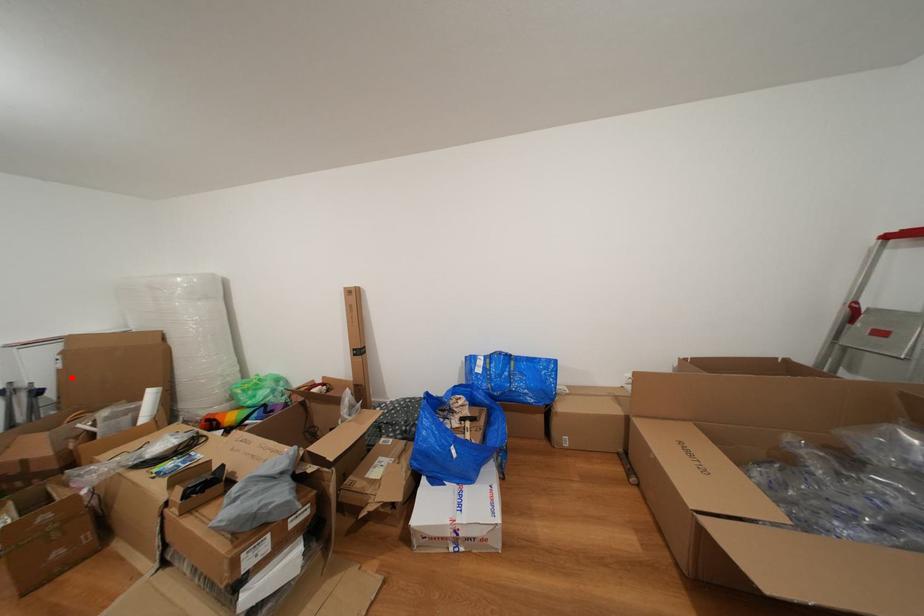
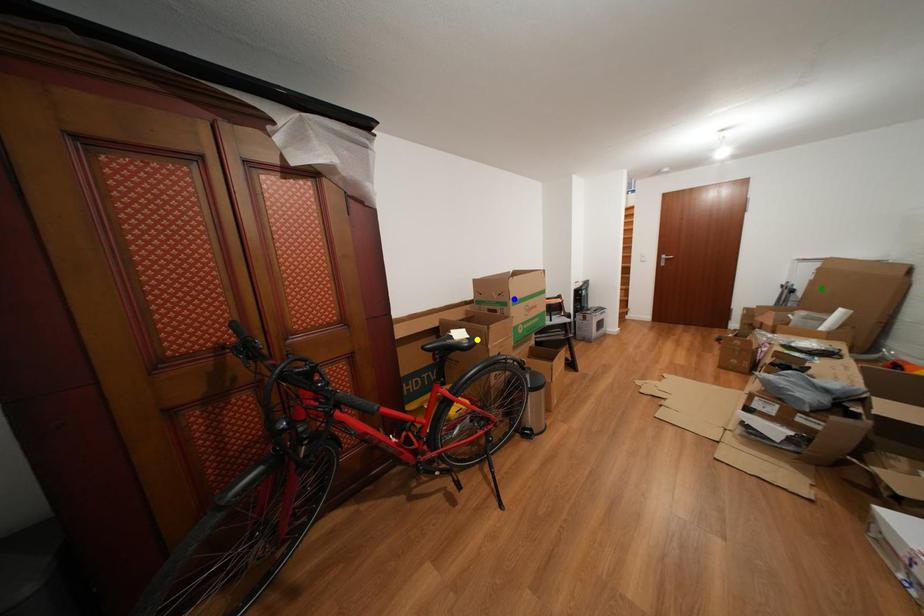
Question: I am providing you with two images of the same scene from different viewpoints. A red point is marked on the first image. You are given multiple points on the second image. Which point in image 2 represents the same 3d spot as the red point in image 1?

Choices:
 (A) yellow point
 (B) green point
 (C) blue point

Answer: (B)